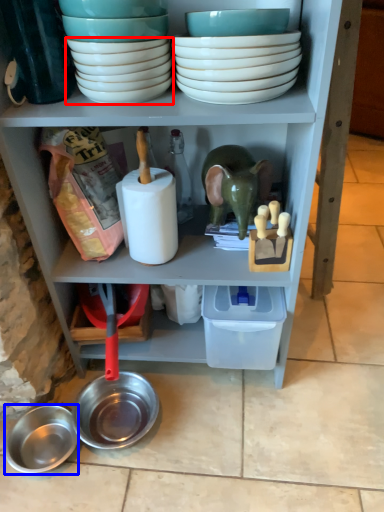
Question: Which of the following is the closest to the observer, bowl (highlighted by a red box) or bowl (highlighted by a blue box)?

Choices:
 (A) bowl
 (B) bowl

Answer: (A)